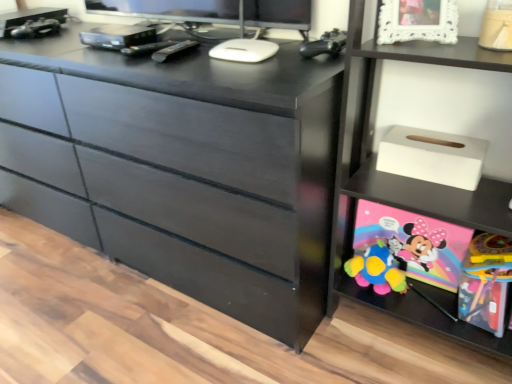
The image size is (512, 384). I want to click on free space on the front side of black matte controller at upper right, placed as the 2th toy when sorted from right to left, so click(x=314, y=70).